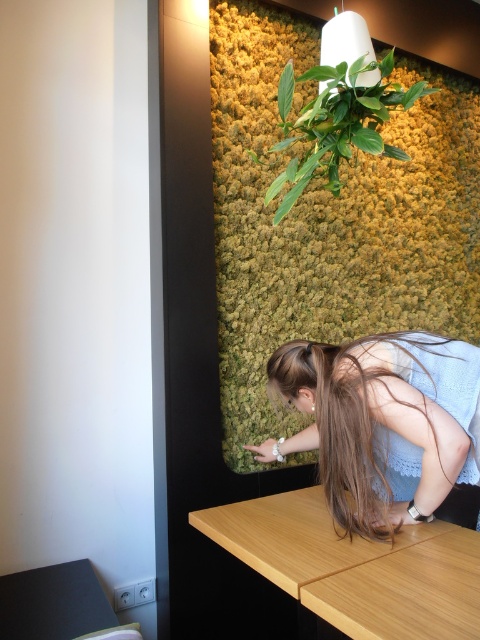
Question: Is light wood table at lower center further to camera compared to green leafy plant at upper center?

Choices:
 (A) yes
 (B) no

Answer: (B)

Question: In this image, where is light wood table at lower center located relative to smooth black table at lower left?

Choices:
 (A) left
 (B) right

Answer: (B)

Question: Which of the following is the farthest from the observer?

Choices:
 (A) green leafy plant at upper center
 (B) light wood table at lower center
 (C) smooth black table at lower left
 (D) blue lace dress at center

Answer: (A)

Question: Does light wood table at lower center have a smaller size compared to smooth black table at lower left?

Choices:
 (A) no
 (B) yes

Answer: (A)

Question: Which point is farther to the camera?

Choices:
 (A) green leafy plant at upper center
 (B) smooth black table at lower left

Answer: (A)

Question: Among these points, which one is farthest from the camera?

Choices:
 (A) (304, 76)
 (B) (368, 493)
 (C) (328, 605)

Answer: (A)